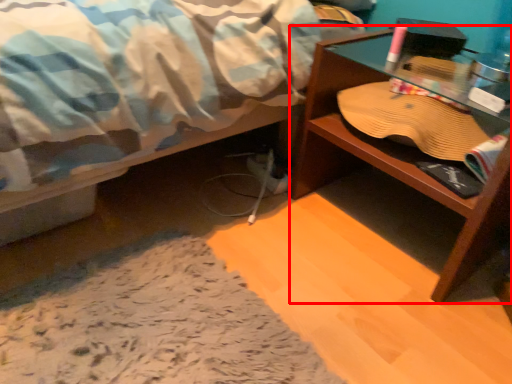
Question: From the image's perspective, what is the correct spatial positioning of desk (annotated by the red box) in reference to glass table?

Choices:
 (A) below
 (B) above

Answer: (A)